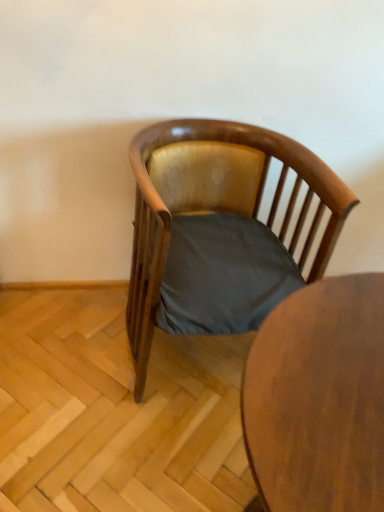
Question: Is wooden table at center a part of wooden polished chair at center?

Choices:
 (A) no
 (B) yes

Answer: (A)

Question: Considering the relative sizes of wooden polished chair at center and wooden table at center in the image provided, is wooden polished chair at center bigger than wooden table at center?

Choices:
 (A) no
 (B) yes

Answer: (B)

Question: Considering the relative sizes of wooden polished chair at center and wooden table at center in the image provided, is wooden polished chair at center smaller than wooden table at center?

Choices:
 (A) no
 (B) yes

Answer: (A)

Question: From a real-world perspective, is wooden polished chair at center physically below wooden table at center?

Choices:
 (A) yes
 (B) no

Answer: (B)

Question: From a real-world perspective, is wooden polished chair at center positioned over wooden table at center based on gravity?

Choices:
 (A) no
 (B) yes

Answer: (B)

Question: Can you confirm if wooden polished chair at center is shorter than wooden table at center?

Choices:
 (A) no
 (B) yes

Answer: (B)

Question: Is wooden table at center completely or partially outside of wooden polished chair at center?

Choices:
 (A) no
 (B) yes

Answer: (B)

Question: Is wooden table at center aimed at wooden polished chair at center?

Choices:
 (A) yes
 (B) no

Answer: (B)

Question: Is wooden table at center turned away from wooden polished chair at center?

Choices:
 (A) no
 (B) yes

Answer: (B)

Question: Considering the relative positions of wooden table at center and wooden polished chair at center in the image provided, is wooden table at center behind wooden polished chair at center?

Choices:
 (A) yes
 (B) no

Answer: (B)

Question: Is wooden table at center at the left side of wooden polished chair at center?

Choices:
 (A) no
 (B) yes

Answer: (A)

Question: Is wooden table at center in front of wooden polished chair at center?

Choices:
 (A) no
 (B) yes

Answer: (B)

Question: From their relative heights in the image, would you say wooden polished chair at center is taller or shorter than wooden table at center?

Choices:
 (A) short
 (B) tall

Answer: (A)